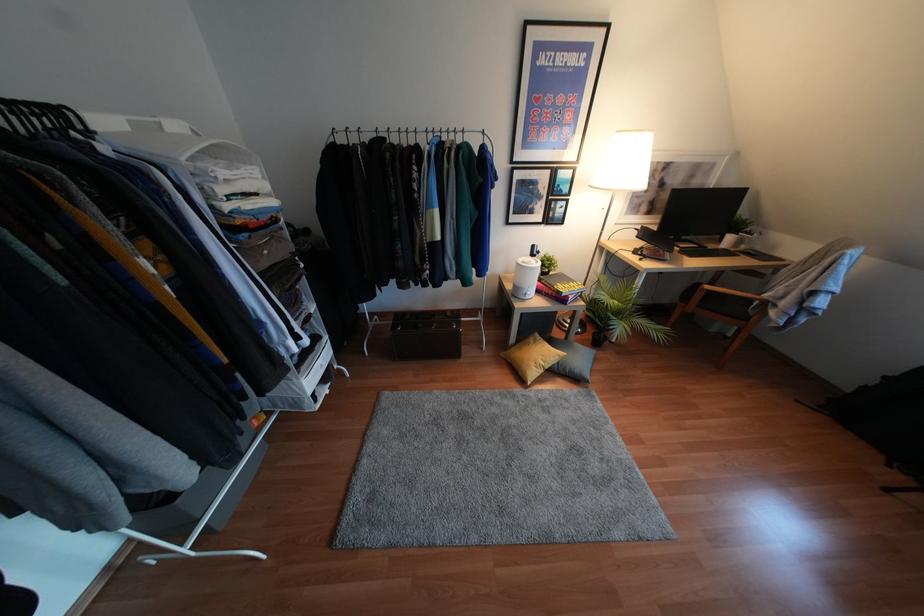
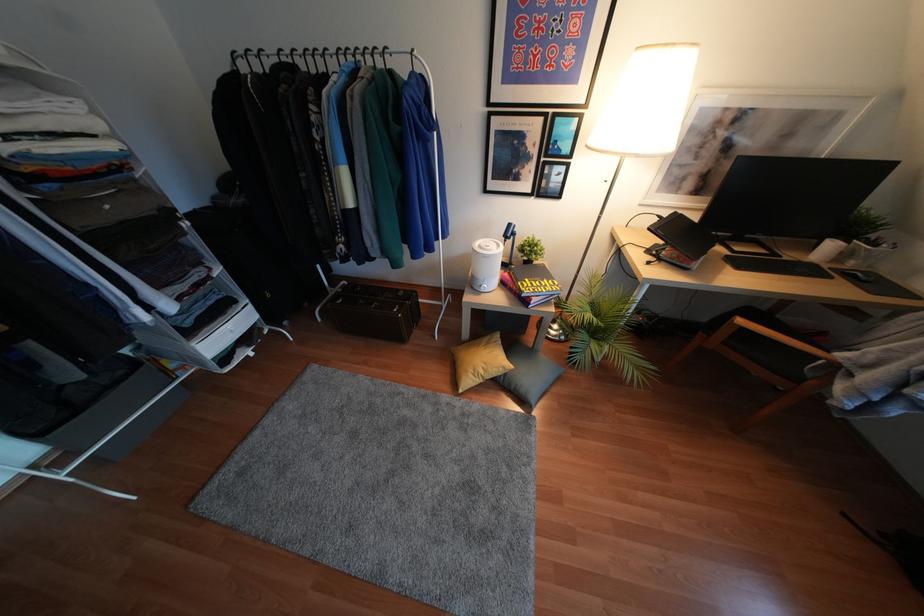
Question: How did the camera likely rotate?

Choices:
 (A) Left
 (B) Right
 (C) Up
 (D) Down

Answer: (A)